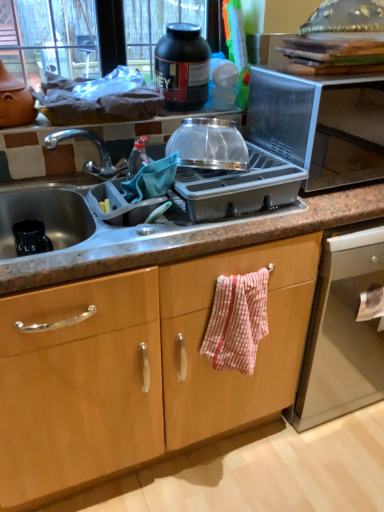
You are a GUI agent. You are given a task and a screenshot of the screen. Output one action in this format:
    pyautogui.click(x=<x>, y=<y>)
    Task: Click on the free point below transparent plastic bowl at upper center, which is the first kitchen appliance from front to back (from a real-world perspective)
    
    Given the screenshot: What is the action you would take?
    pyautogui.click(x=210, y=170)